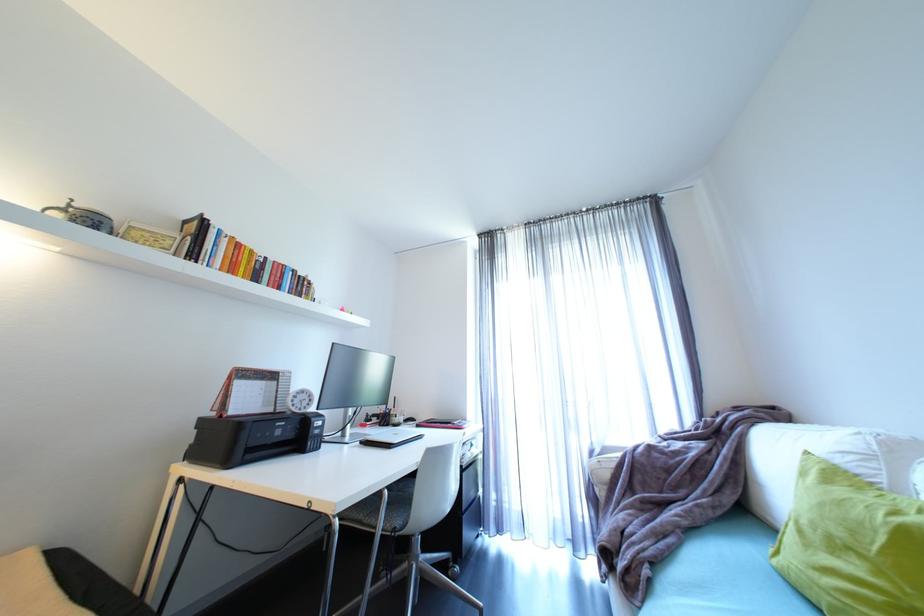
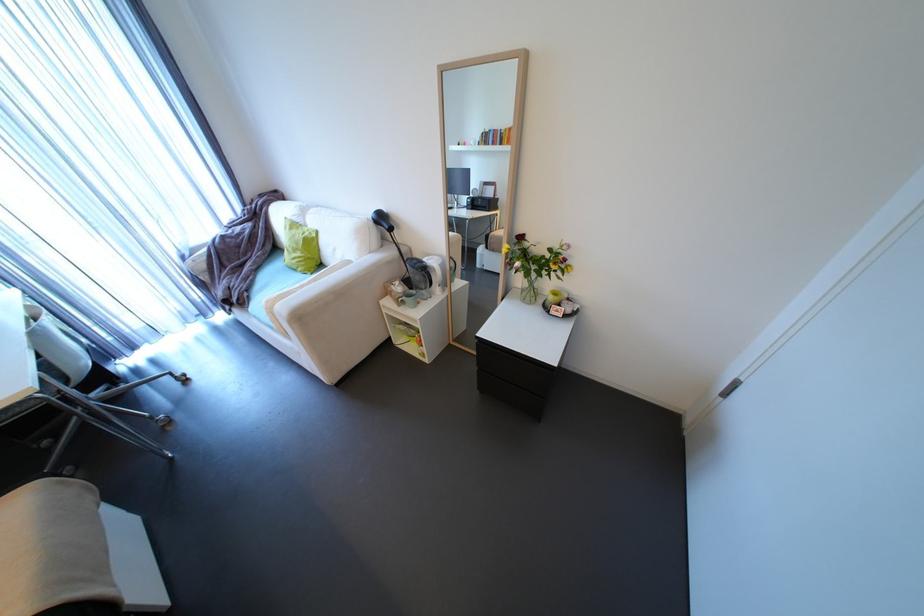
Find the pixel in the second image that matches (x=636, y=581) in the first image.

(248, 302)